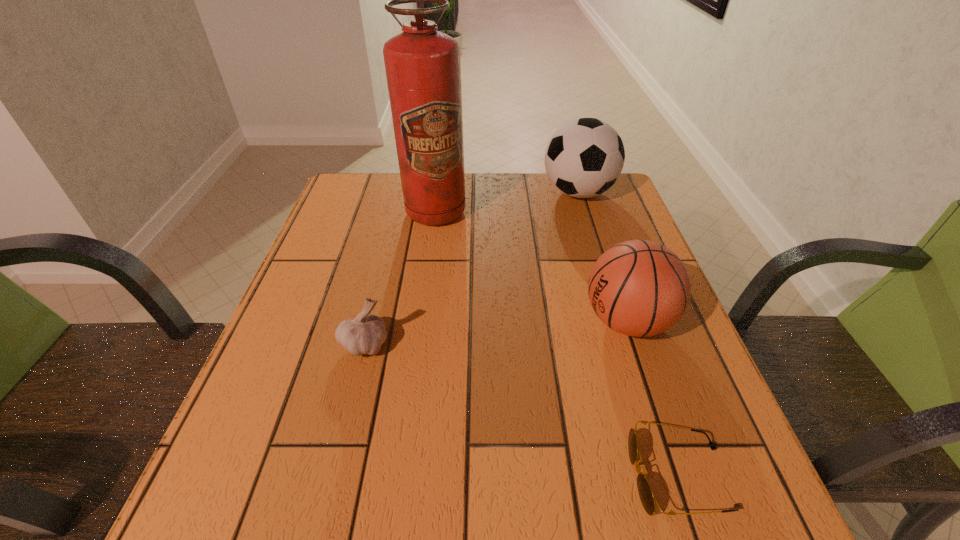
Where is `the tallest object`? This screenshot has width=960, height=540. the tallest object is located at coordinates (423, 70).

I want to click on soccer ball, so click(584, 158).

You are a GUI agent. You are given a task and a screenshot of the screen. Output one action in this format:
    pyautogui.click(x=<x>, y=<y>)
    Task: Click on the basketball
    
    Given the screenshot: What is the action you would take?
    pyautogui.click(x=640, y=288)

You are a GUI agent. You are given a task and a screenshot of the screen. Output one action in this format:
    pyautogui.click(x=<x>, y=<y>)
    Task: Click on the second shortest object
    The image size is (960, 540).
    Given the screenshot: What is the action you would take?
    pyautogui.click(x=365, y=334)

In order to click on the nearest object in this screenshot , I will do `click(647, 498)`.

At what (x,y) coordinates should I click in order to perform the action: click on the shortest object. Please return your answer as a coordinate pair (x, y). This screenshot has width=960, height=540. Looking at the image, I should click on coord(647,498).

The width and height of the screenshot is (960, 540). In order to click on vacant space situated on the label side of the tallest object in this screenshot , I will do `click(416, 354)`.

Find the location of a particular element. free space located 0.050m on the left of the soccer ball is located at coordinates (524, 192).

The width and height of the screenshot is (960, 540). I want to click on free space located 0.130m on the surface of the third shortest object near the brand logo, so click(518, 321).

You are a GUI agent. You are given a task and a screenshot of the screen. Output one action in this format:
    pyautogui.click(x=<x>, y=<y>)
    Task: Click on the free space located on the surface of the third shortest object near the brand logo
    This screenshot has height=540, width=960.
    Given the screenshot: What is the action you would take?
    coord(523,321)